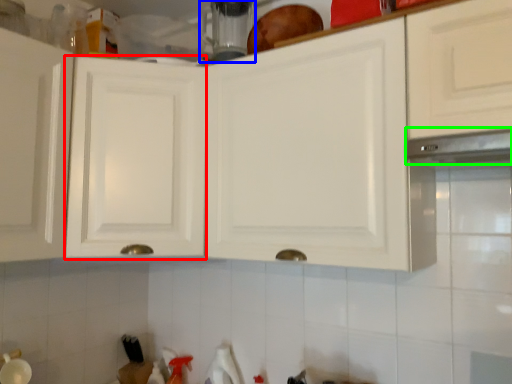
Question: Which object is positioned closest to cabinetry (highlighted by a red box)? Select from appliance (highlighted by a blue box) and exhaust hood (highlighted by a green box).

Choices:
 (A) appliance
 (B) exhaust hood

Answer: (A)